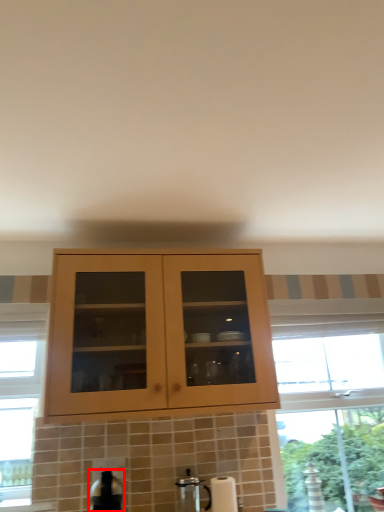
Question: From the image, what is the correct spatial relationship of appliance (annotated by the red box) in relation to coffee machine?

Choices:
 (A) left
 (B) right

Answer: (A)